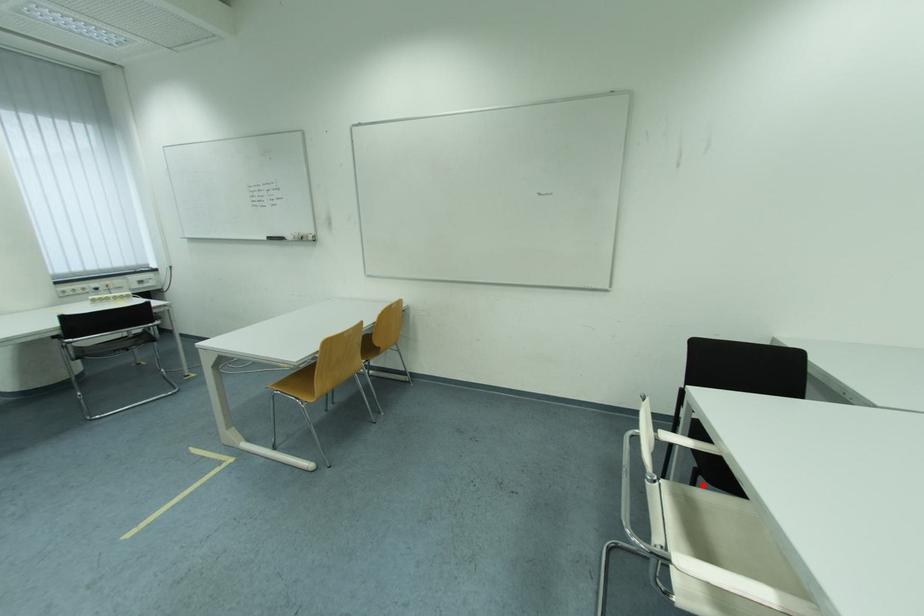
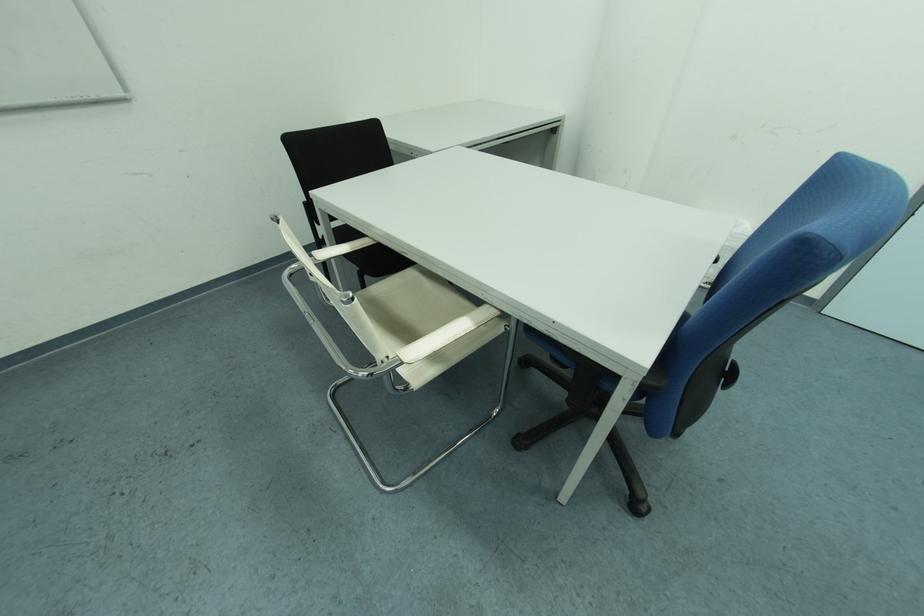
Find the pixel in the second image that matches the highlighted location in the first image.

(372, 286)